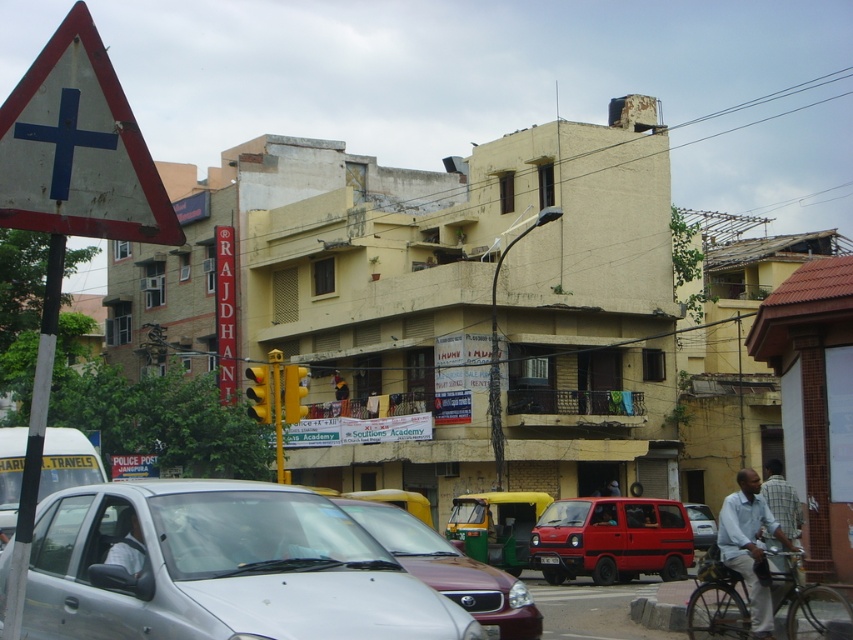
You are a delivery person trying to park your motorcycle between the silver metallic car at center and the maroon matte car at center. Based on their sizes, which car should you position your motorcycle closer to for better space utilization?

Since the silver metallic car at center is smaller than the maroon matte car at center, you should position your motorcycle closer to the silver metallic car at center to maximize space utilization.

You are a delivery person trying to navigate through the street. You see the silver metallic car at center and the red matte van at center. Which vehicle is positioned higher in the image?

The silver metallic car at center is positioned higher than the red matte van at center in the image.